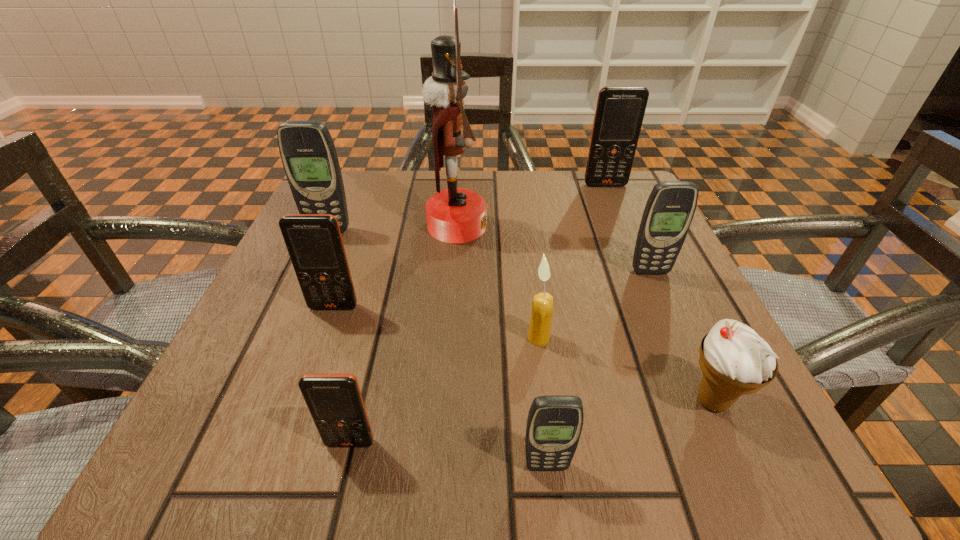
What are the coordinates of `object that is positioned at the near right corner` in the screenshot? It's located at (735, 360).

The width and height of the screenshot is (960, 540). Identify the location of free space at the far edge. (403, 187).

Identify the location of vacant region at the near edge of the desktop. [x=603, y=430].

Find the location of `vacant space at the left edge of the desktop`. vacant space at the left edge of the desktop is located at coordinates (241, 358).

In the image, there is a desktop. In order to click on free region at the right edge in this screenshot , I will do `click(679, 372)`.

Locate an element on the screen. This screenshot has width=960, height=540. vacant space at the far left corner of the desktop is located at coordinates (357, 200).

This screenshot has width=960, height=540. In the image, there is a desktop. Find the location of `vacant space at the near left corner`. vacant space at the near left corner is located at coordinates (310, 431).

At what (x,y) coordinates should I click in order to perform the action: click on free space at the far right corner. Please return your answer as a coordinate pair (x, y). Looking at the image, I should click on (598, 219).

I want to click on free space between the fourth object from left to right and the cream candle, so click(498, 282).

Where is `unoccupied area between the third nearest object and the rightmost gray cellular telephone`? The width and height of the screenshot is (960, 540). unoccupied area between the third nearest object and the rightmost gray cellular telephone is located at coordinates (682, 336).